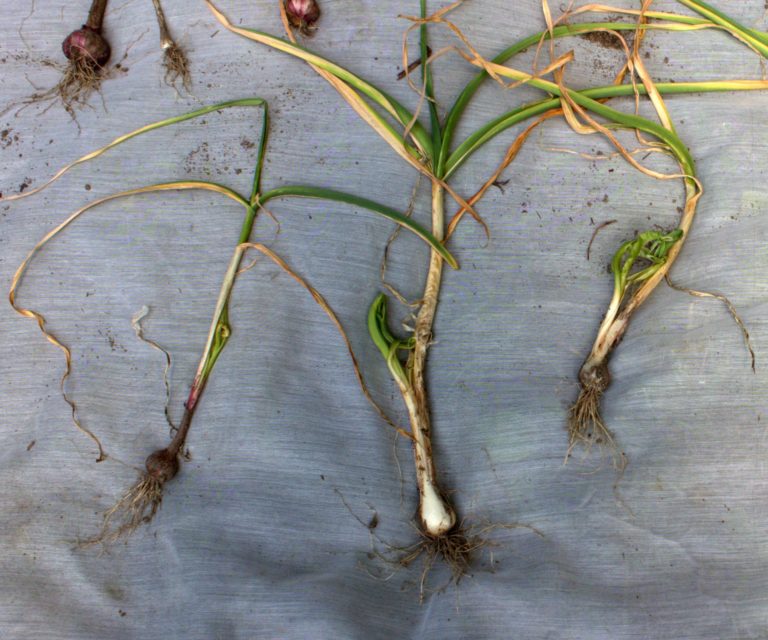
Where is `bulb`? bulb is located at coordinates (171, 467).